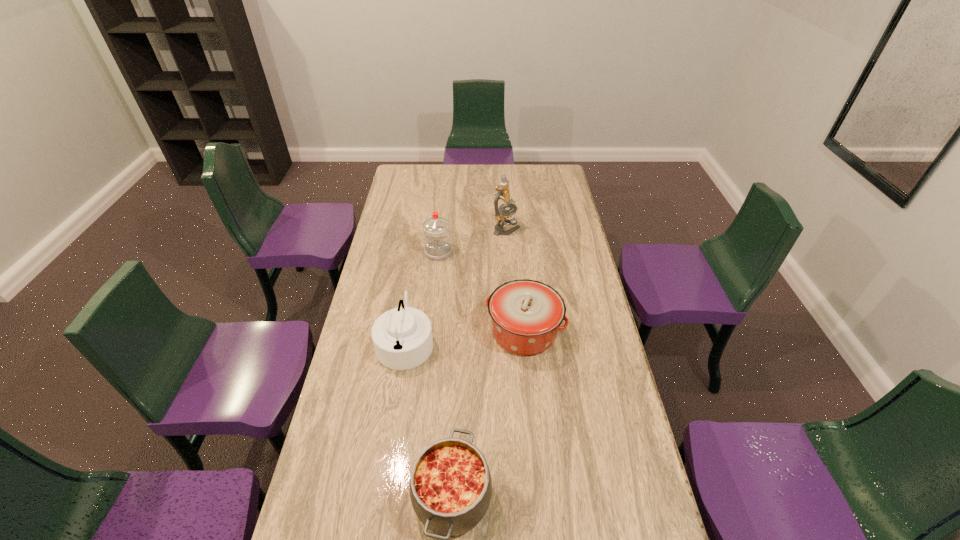
Locate which object ranks in proximity to the kettle. Please provide its 2D coordinates. Your answer should be formatted as a tuple, i.e. [(x, y)], where the tuple contains the x and y coordinates of a point satisfying the conditions above.

[(526, 314)]

Image resolution: width=960 pixels, height=540 pixels. Identify the location of vacant region that satisfies the following two spatial constraints: 1. on the handle side of the second farthest object; 2. on the left side of the farther casserole. (430, 332).

Where is `blank area in the image that satisfies the following two spatial constraints: 1. on the handle side of the taller casserole; 2. on the left side of the second farthest object`? The image size is (960, 540). blank area in the image that satisfies the following two spatial constraints: 1. on the handle side of the taller casserole; 2. on the left side of the second farthest object is located at coordinates (430, 332).